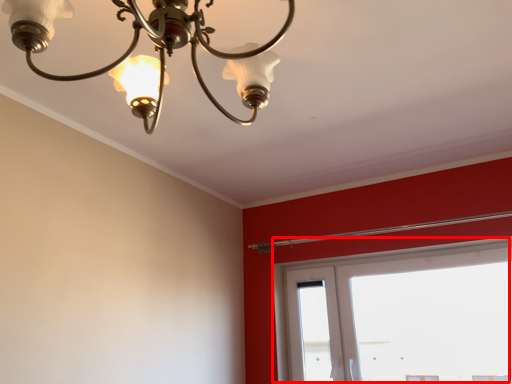
Question: From the image's perspective, what is the correct spatial relationship of window (annotated by the red box) in relation to lamp?

Choices:
 (A) below
 (B) above

Answer: (A)